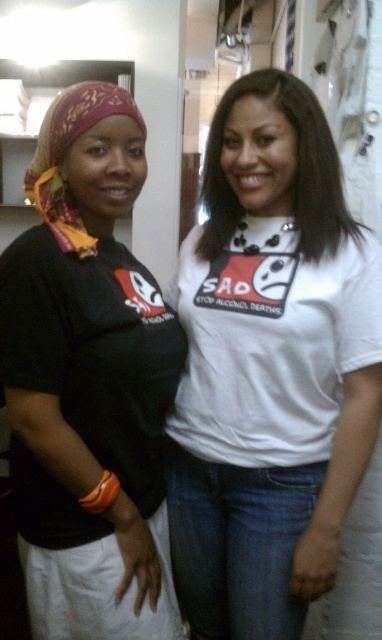
You are standing at the point marked by the coordinates point (121, 205). You want to move to the door located at the opposite side of the room. How far will you have to walk to reach the door?

The distance between point (121, 205) and the door is 3.52 feet, so you will have to walk 3.52 feet to reach the door.